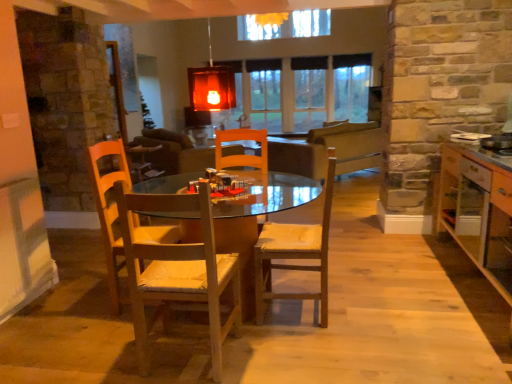
Find the location of a particular element. The width and height of the screenshot is (512, 384). clear glass window at center is located at coordinates (303, 91).

What do you see at coordinates (296, 253) in the screenshot? I see `wooden chair with cushion at center, placed as the 2th chair when sorted from left to right` at bounding box center [296, 253].

What are the coordinates of `wooden cabinet at right` in the screenshot? It's located at (477, 212).

Considering the sizes of objects clear glass window at center and wooden chair with cushion at center, positioned as the 1th chair in right-to-left order, in the image provided, who is taller, clear glass window at center or wooden chair with cushion at center, positioned as the 1th chair in right-to-left order,?

clear glass window at center is taller.

Which is more to the left, clear glass window at center or wooden chair with cushion at center, positioned as the 1th chair in right-to-left order?

wooden chair with cushion at center, positioned as the 1th chair in right-to-left order.

Is there a large distance between clear glass window at center and wooden chair with cushion at center, placed as the 2th chair when sorted from left to right?

That's right, there is a large distance between clear glass window at center and wooden chair with cushion at center, placed as the 2th chair when sorted from left to right.

From a real-world perspective, is wooden table at center positioned under matte glass lampshade at upper center based on gravity?

Yes, from a real-world perspective, wooden table at center is under matte glass lampshade at upper center.

At what (x,y) coordinates should I click in order to perform the action: click on light fixture above the wooden table at center (from a real-world perspective). Please return your answer as a coordinate pair (x, y). This screenshot has width=512, height=384. Looking at the image, I should click on (211, 85).

Could you tell me if wooden table at center is turned towards matte glass lampshade at upper center?

No.

Is wooden table at center positioned far away from matte glass lampshade at upper center?

Indeed, wooden table at center is not near matte glass lampshade at upper center.

Considering the positions of points (214, 266) and (453, 158), is point (214, 266) closer to camera compared to point (453, 158)?

Yes, point (214, 266) is in front of point (453, 158).

From a real-world perspective, which is physically above, wooden chair at center, the first chair viewed from the left, or wooden cabinet at right?

In real-world perspective, wooden chair at center, the first chair viewed from the left, is above.

In the scene shown: Can you confirm if wooden chair at center, the first chair viewed from the left, is thinner than wooden cabinet at right?

Yes.

Is the surface of wooden chair at center, the first chair viewed from the left, in direct contact with wooden cabinet at right?

wooden chair at center, the first chair viewed from the left, is not next to wooden cabinet at right, and they're not touching.

Is clear glass window at center to the left or to the right of wooden table at center in the image?

From the image, it's evident that clear glass window at center is to the right of wooden table at center.

From the picture: From a real-world perspective, does clear glass window at center sit lower than wooden table at center?

Incorrect, from a real-world perspective, clear glass window at center is higher than wooden table at center.

From the image's perspective, which object appears higher, clear glass window at center or wooden table at center?

clear glass window at center, from the image's perspective.

Can you tell me how much clear glass window at center and wooden table at center differ in facing direction?

The facing directions of clear glass window at center and wooden table at center are 178 degrees apart.

From a real-world perspective, is clear glass window at center on top of matte glass lampshade at upper center?

No, from a real-world perspective, clear glass window at center is not over matte glass lampshade at upper center

In order to click on window located behind the matte glass lampshade at upper center in this screenshot , I will do `click(303, 91)`.

Is clear glass window at center closer to the viewer compared to matte glass lampshade at upper center?

No, clear glass window at center is behind matte glass lampshade at upper center.

How many degrees apart are the facing directions of wooden table at center and clear glass window at center?

178 degrees separate the facing orientations of wooden table at center and clear glass window at center.

How far apart are wooden table at center and clear glass window at center?

A distance of 4.17 feet exists between wooden table at center and clear glass window at center.

In the scene shown: Considering the positions of objects wooden table at center and clear glass window at center in the image provided, who is more to the left, wooden table at center or clear glass window at center?

wooden table at center is more to the left.

Is wooden table at center facing away from clear glass window at center?

No, clear glass window at center is not at the back of wooden table at center.

Is wooden chair at center, the first chair viewed from the left, facing away from matte glass lampshade at upper center?

No, wooden chair at center, the first chair viewed from the left, is not facing the opposite direction of matte glass lampshade at upper center.

Does wooden chair at center, marked as the second chair in a right-to-left arrangement, have a greater width compared to matte glass lampshade at upper center?

Indeed, wooden chair at center, marked as the second chair in a right-to-left arrangement, has a greater width compared to matte glass lampshade at upper center.

From a real-world perspective, is wooden chair at center, marked as the second chair in a right-to-left arrangement, physically below matte glass lampshade at upper center?

Yes, from a real-world perspective, wooden chair at center, marked as the second chair in a right-to-left arrangement, is beneath matte glass lampshade at upper center.

Is wooden chair at center, the first chair viewed from the left, shorter than matte glass lampshade at upper center?

In fact, wooden chair at center, the first chair viewed from the left, may be taller than matte glass lampshade at upper center.

Locate an element on the screen. Image resolution: width=512 pixels, height=384 pixels. window on the right side of wooden chair with cushion at center, placed as the 2th chair when sorted from left to right is located at coordinates (303, 91).

At what (x,y) coordinates should I click in order to perform the action: click on light fixture that appears above the wooden table at center (from a real-world perspective). Please return your answer as a coordinate pair (x, y). The image size is (512, 384). Looking at the image, I should click on (211, 85).

Based on their spatial positions, is matte glass lampshade at upper center or wooden chair with cushion at center, placed as the 2th chair when sorted from left to right, further from wooden chair at center, marked as the second chair in a right-to-left arrangement?

matte glass lampshade at upper center.

Looking at the image, which one is located further to wooden chair at center, the first chair viewed from the left, wooden table at center or wooden chair with cushion at center, positioned as the 1th chair in right-to-left order?

Among the two, wooden table at center is located further to wooden chair at center, the first chair viewed from the left.

Considering their positions, is matte glass lampshade at upper center positioned closer to clear glass window at center than wooden chair with cushion at center, positioned as the 1th chair in right-to-left order?

wooden chair with cushion at center, positioned as the 1th chair in right-to-left order, lies closer to clear glass window at center than the other object.

Looking at the image, which one is located further to matte glass lampshade at upper center, wooden table at center or wooden cabinet at right?

Among the two, wooden table at center is located further to matte glass lampshade at upper center.

Which object lies nearer to the anchor point wooden chair with cushion at center, positioned as the 1th chair in right-to-left order, wooden table at center or wooden cabinet at right?

Based on the image, wooden cabinet at right appears to be nearer to wooden chair with cushion at center, positioned as the 1th chair in right-to-left order.

From the image, which object appears to be nearer to clear glass window at center, wooden chair with cushion at center, positioned as the 1th chair in right-to-left order, or matte glass lampshade at upper center?

Based on the image, wooden chair with cushion at center, positioned as the 1th chair in right-to-left order, appears to be nearer to clear glass window at center.

From the image, which object appears to be nearer to clear glass window at center, wooden chair at center, marked as the second chair in a right-to-left arrangement, or matte glass lampshade at upper center?

Based on the image, matte glass lampshade at upper center appears to be nearer to clear glass window at center.

Looking at the image, which one is located further to wooden cabinet at right, wooden chair with cushion at center, positioned as the 1th chair in right-to-left order, or wooden chair at center, the first chair viewed from the left?

Among the two, wooden chair at center, the first chair viewed from the left, is located further to wooden cabinet at right.

Where is `desk located between wooden chair at center, marked as the second chair in a right-to-left arrangement, and clear glass window at center in the depth direction`? The width and height of the screenshot is (512, 384). desk located between wooden chair at center, marked as the second chair in a right-to-left arrangement, and clear glass window at center in the depth direction is located at coordinates (258, 225).

You are a GUI agent. You are given a task and a screenshot of the screen. Output one action in this format:
    pyautogui.click(x=<x>, y=<y>)
    Task: Click on the light fixture located between wooden table at center and clear glass window at center in the depth direction
    
    Given the screenshot: What is the action you would take?
    pyautogui.click(x=211, y=85)

I want to click on chair between wooden chair at center, marked as the second chair in a right-to-left arrangement, and clear glass window at center from front to back, so click(x=296, y=253).

Locate an element on the screen. The width and height of the screenshot is (512, 384). chair situated between wooden table at center and wooden cabinet at right from left to right is located at coordinates tap(296, 253).